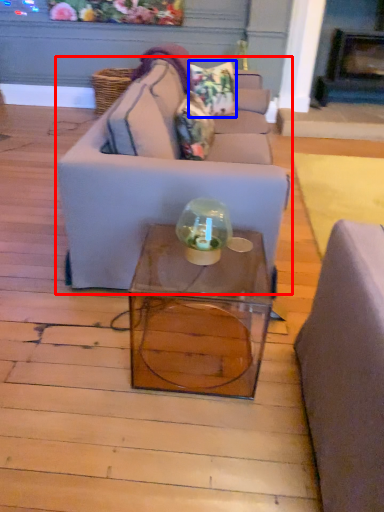
Question: Which point is closer to the camera, studio couch (highlighted by a red box) or pillow (highlighted by a blue box)?

Choices:
 (A) studio couch
 (B) pillow

Answer: (A)